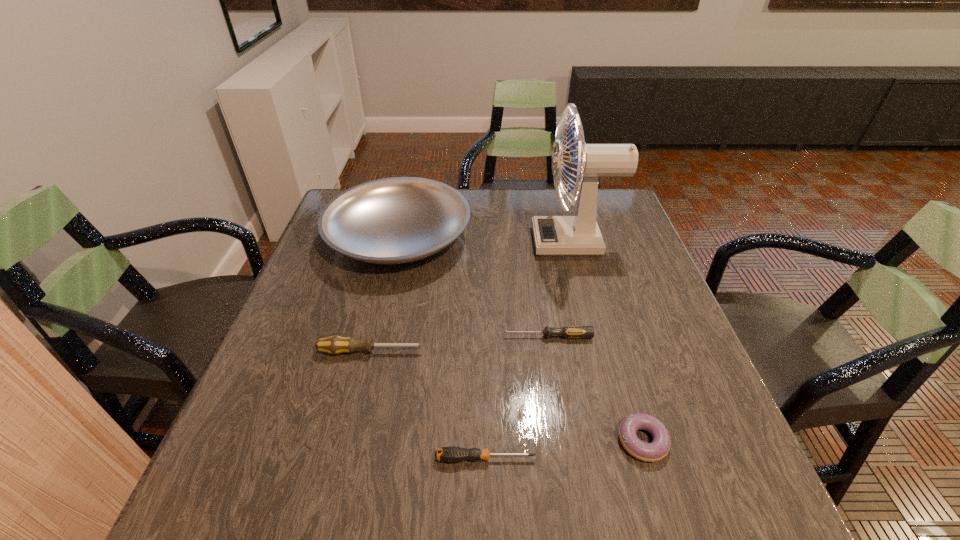
Where is `free space that is in between the fan and the doughnut`? Image resolution: width=960 pixels, height=540 pixels. free space that is in between the fan and the doughnut is located at coordinates (608, 341).

Image resolution: width=960 pixels, height=540 pixels. Find the location of `the third closest object to the tallest object`. the third closest object to the tallest object is located at coordinates (334, 345).

Point out which object is positioned as the fifth nearest to the second farthest screwdriver. Please provide its 2D coordinates. Your answer should be formatted as a tuple, i.e. [(x, y)], where the tuple contains the x and y coordinates of a point satisfying the conditions above.

[(656, 450)]

Identify which screwdriver is the second nearest to the doughnut. Please provide its 2D coordinates. Your answer should be formatted as a tuple, i.e. [(x, y)], where the tuple contains the x and y coordinates of a point satisfying the conditions above.

[(567, 331)]

Locate an element on the screen. screwdriver that stands as the second closest to the nearest screwdriver is located at coordinates (567, 331).

The height and width of the screenshot is (540, 960). In order to click on free space that satisfies the following two spatial constraints: 1. on the front side of the bedpan; 2. at the tip of the leftmost screwdriver in this screenshot , I will do `click(372, 352)`.

Identify the location of vacant space that satisfies the following two spatial constraints: 1. insert the farthest screwdriver into a screw head; 2. on the front side of the nearest screwdriver. This screenshot has width=960, height=540. (566, 458).

The height and width of the screenshot is (540, 960). I want to click on vacant space that satisfies the following two spatial constraints: 1. insert the farthest screwdriver into a screw head; 2. on the front side of the nearest screwdriver, so click(566, 458).

You are a GUI agent. You are given a task and a screenshot of the screen. Output one action in this format:
    pyautogui.click(x=<x>, y=<y>)
    Task: Click on the vacant space that satisfies the following two spatial constraints: 1. on the back side of the nearest screwdriver; 2. on the left side of the doughnut
    The width and height of the screenshot is (960, 540).
    Given the screenshot: What is the action you would take?
    pyautogui.click(x=485, y=441)

Locate an element on the screen. The image size is (960, 540). free space that satisfies the following two spatial constraints: 1. on the front side of the bedpan; 2. at the tip of the leftmost screwdriver is located at coordinates (372, 352).